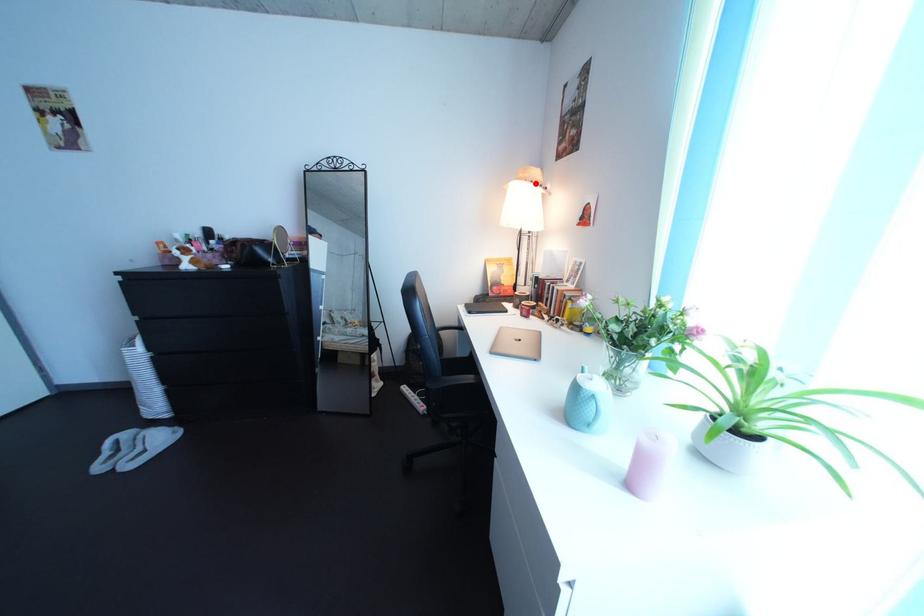
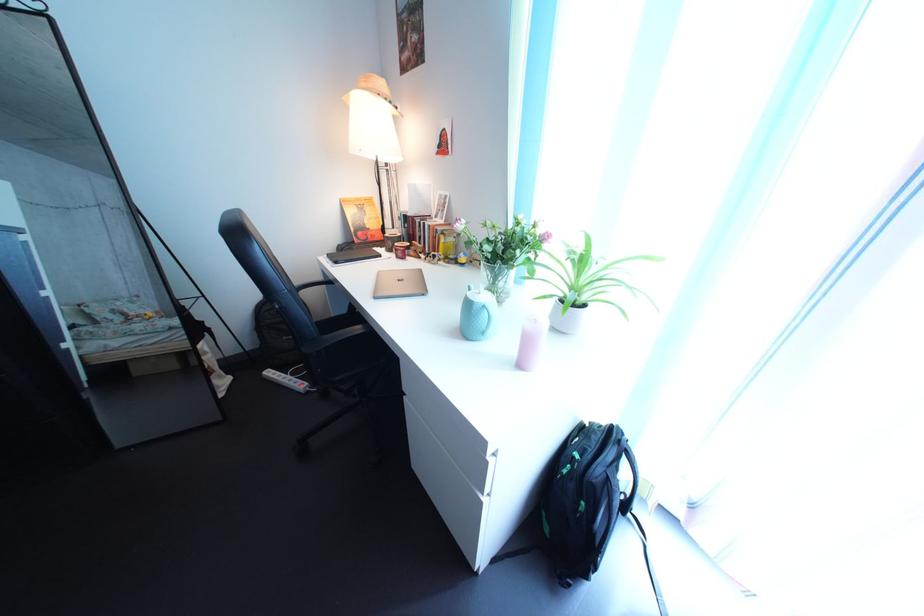
Find the pixel in the second image that matches the highlighted location in the first image.

(378, 92)